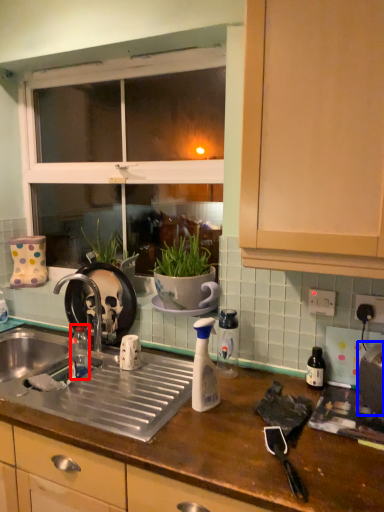
Question: Which object is closer to the camera taking this photo, bottle (highlighted by a red box) or appliance (highlighted by a blue box)?

Choices:
 (A) bottle
 (B) appliance

Answer: (B)